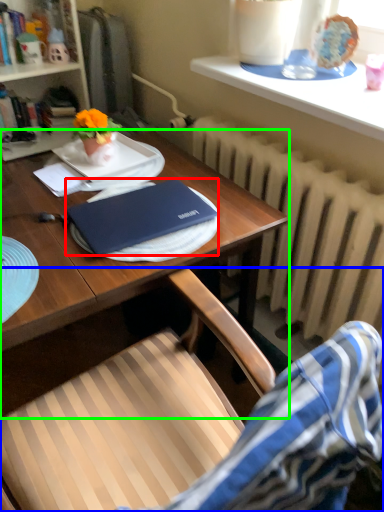
Question: Which object is the farthest from laptop (highlighted by a red box)? Choose among these: chair (highlighted by a blue box) or desk (highlighted by a green box).

Choices:
 (A) chair
 (B) desk

Answer: (A)